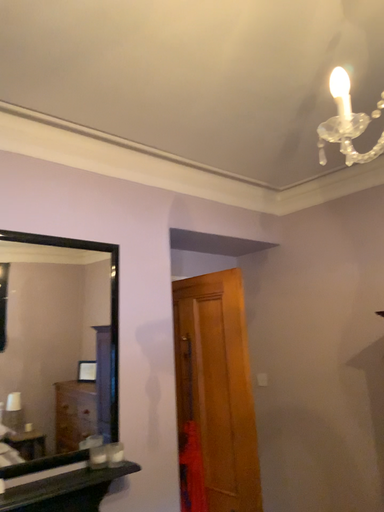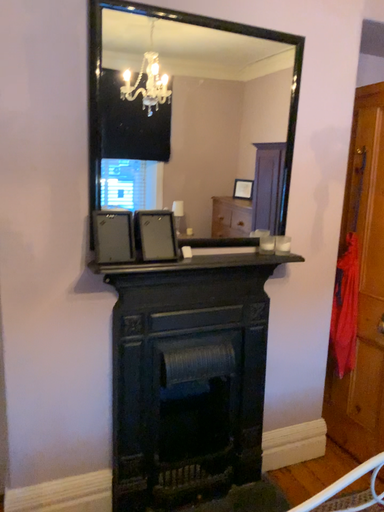
Question: How did the camera likely rotate when shooting the video?

Choices:
 (A) rotated downward
 (B) rotated upward

Answer: (A)